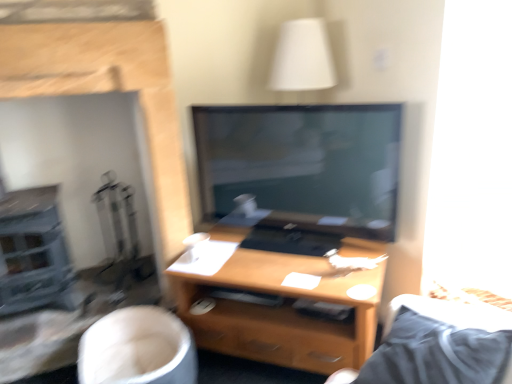
Question: Is smooth stone fireplace at left at the right side of white fabric swivel chair at lower left?

Choices:
 (A) yes
 (B) no

Answer: (B)

Question: Is smooth stone fireplace at left shorter than white fabric swivel chair at lower left?

Choices:
 (A) no
 (B) yes

Answer: (A)

Question: From the image's perspective, is smooth stone fireplace at left beneath white fabric swivel chair at lower left?

Choices:
 (A) yes
 (B) no

Answer: (B)

Question: From a real-world perspective, is smooth stone fireplace at left located beneath white fabric swivel chair at lower left?

Choices:
 (A) no
 (B) yes

Answer: (A)

Question: Does smooth stone fireplace at left have a lesser width compared to white fabric swivel chair at lower left?

Choices:
 (A) no
 (B) yes

Answer: (B)

Question: Considering the positions of point (358, 362) and point (80, 352), is point (358, 362) closer or farther from the camera than point (80, 352)?

Choices:
 (A) farther
 (B) closer

Answer: (B)

Question: Is wooden desk at center inside the boundaries of white fabric swivel chair at lower left, or outside?

Choices:
 (A) outside
 (B) inside

Answer: (A)

Question: In the image, is wooden desk at center positioned in front of or behind white fabric swivel chair at lower left?

Choices:
 (A) front
 (B) behind

Answer: (B)

Question: In terms of size, does wooden desk at center appear bigger or smaller than white fabric swivel chair at lower left?

Choices:
 (A) small
 (B) big

Answer: (B)

Question: Choose the correct answer: Is smooth stone fireplace at left inside white fabric swivel chair at lower left or outside it?

Choices:
 (A) outside
 (B) inside

Answer: (A)

Question: From their relative heights in the image, would you say smooth stone fireplace at left is taller or shorter than white fabric swivel chair at lower left?

Choices:
 (A) tall
 (B) short

Answer: (A)

Question: From a real-world perspective, is smooth stone fireplace at left physically located above or below white fabric swivel chair at lower left?

Choices:
 (A) above
 (B) below

Answer: (A)

Question: Looking at their shapes, would you say smooth stone fireplace at left is wider or thinner than white fabric swivel chair at lower left?

Choices:
 (A) wide
 (B) thin

Answer: (B)

Question: Looking at their shapes, would you say white fabric swivel chair at lower left is wider or thinner than wooden desk at center?

Choices:
 (A) wide
 (B) thin

Answer: (B)

Question: Is white fabric swivel chair at lower left taller or shorter than wooden desk at center?

Choices:
 (A) tall
 (B) short

Answer: (B)